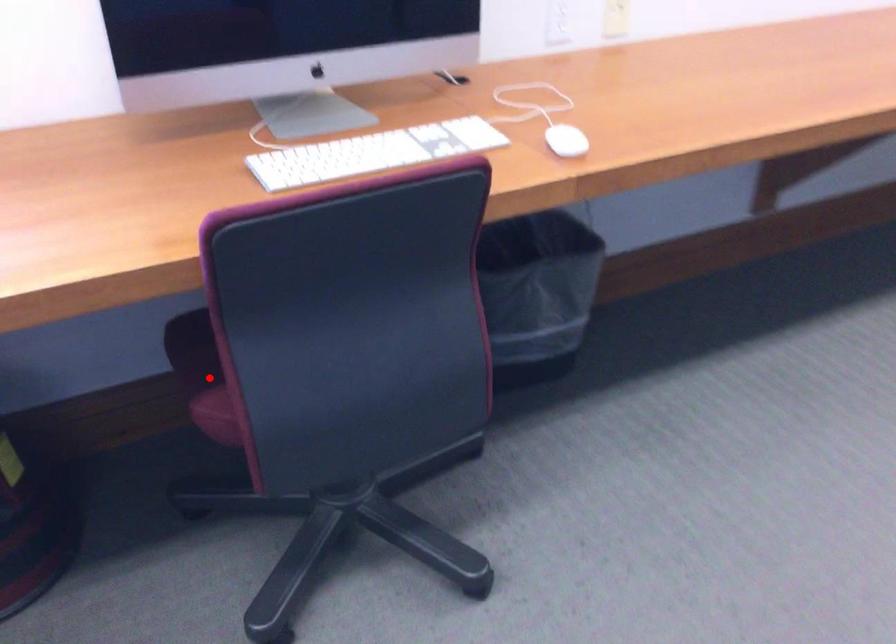
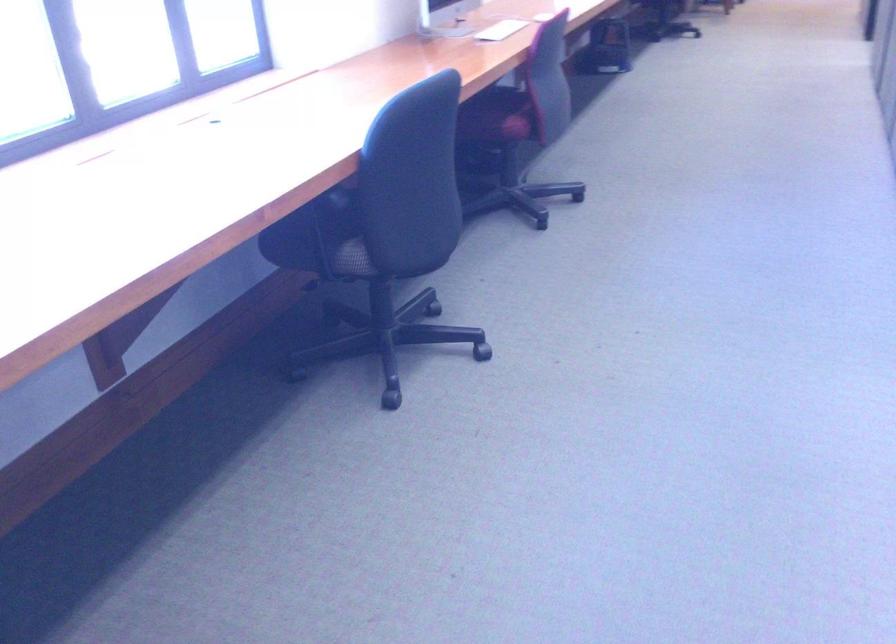
In the second image, find the point that corresponds to the highlighted location in the first image.

(497, 116)